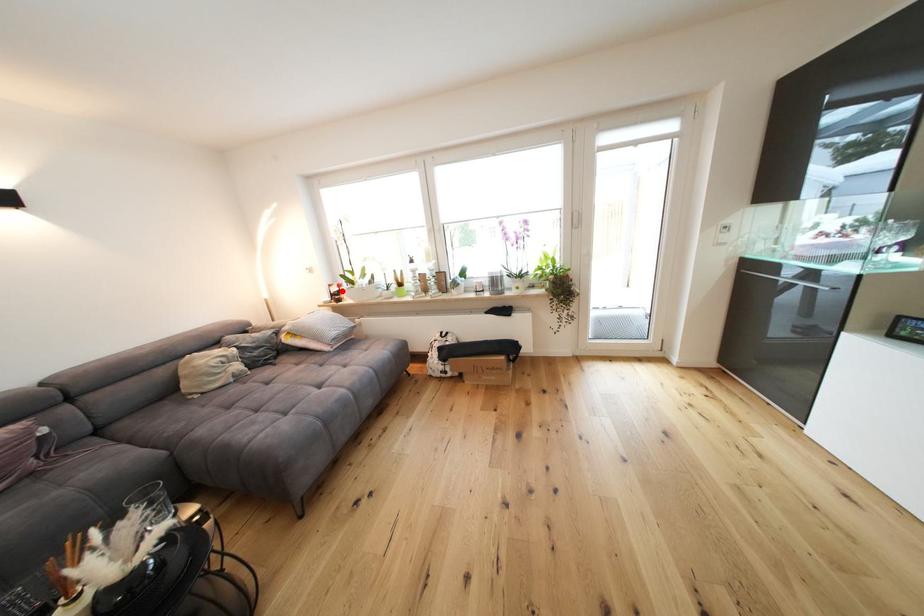
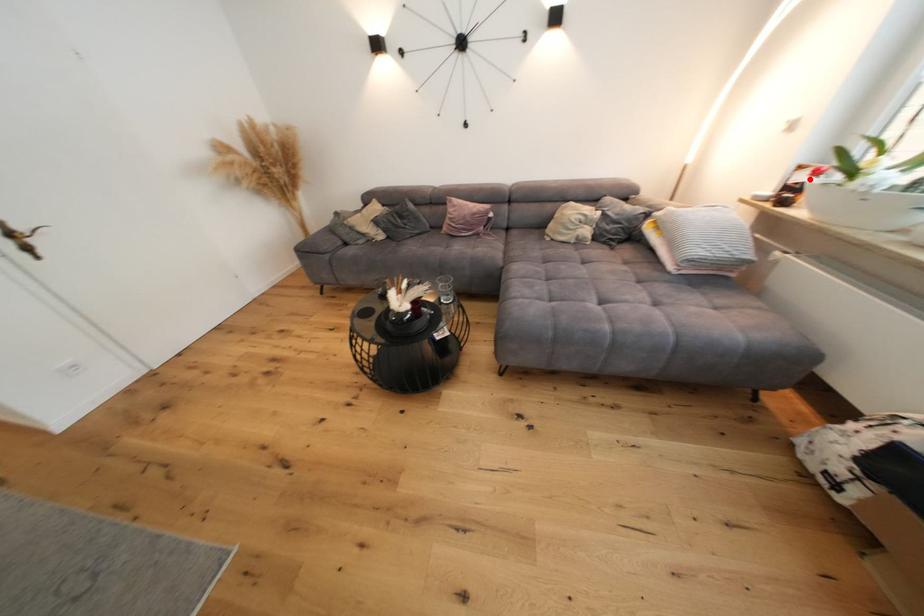
I am providing you with two images of the same scene from different viewpoints. A red point is marked on the first image and another point is marked on the second image. Are the points marked in image1 and image2 representing the same 3D position?

Yes